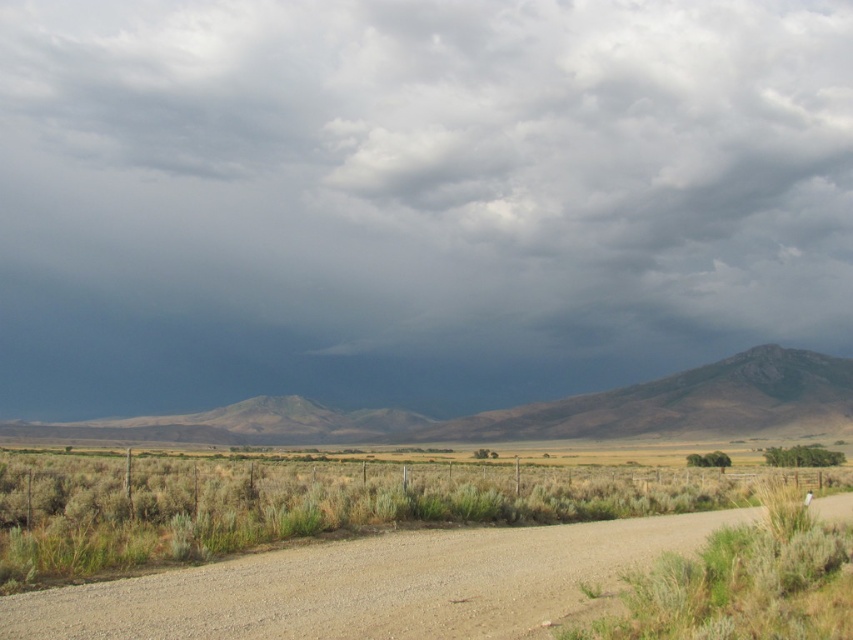
You are a hiker planning to walk from the dirt road to the rugged rock mountain at center. There is green grass at center in your path. Can you walk directly to the mountain without stepping on the grass?

The green grass at center is shorter than rugged rock mountain at center, but the question is about physical obstruction. Since the grass is shorter, it might not block your path. However, the description only mentions height comparison, not width or obstruction. Therefore, based on the given information, there is no indication that the grass prevents direct access to the mountain. You can walk directly to the rugged rock mountain at center without stepping on the grass if there is a clear path around or if

You are standing at the starting point of the dirt road in the foreground. Looking towards the horizon, you see a point marked at coordinates (529, 410). What natural feature does this point indicate?

The point at coordinates (529, 410) corresponds to a rugged brown mountain at center.